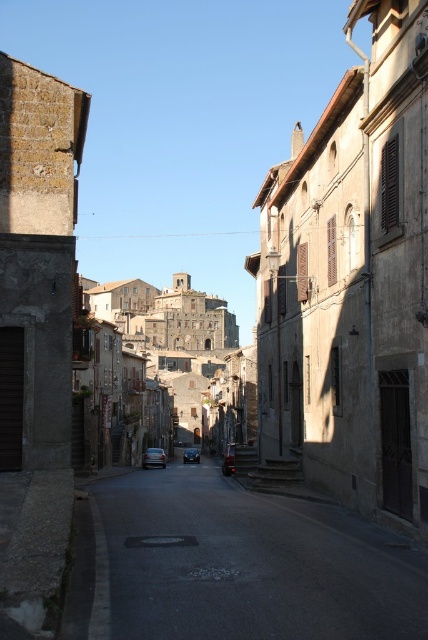
Question: Is stone castle at center smaller than shiny black sedan at center?

Choices:
 (A) yes
 (B) no

Answer: (B)

Question: Can you confirm if dark asphalt road at center is positioned above stone castle at center?

Choices:
 (A) no
 (B) yes

Answer: (A)

Question: Considering the real-world distances, which object is closest to the shiny black sedan at center?

Choices:
 (A) shiny silver car at center
 (B) dark gray metallic car at center
 (C) stone castle at center

Answer: (A)

Question: Which object is positioned farthest from the dark gray metallic car at center?

Choices:
 (A) stone castle at center
 (B) shiny silver car at center
 (C) dark asphalt road at center
 (D) shiny black sedan at center

Answer: (A)

Question: Which object is farther from the camera taking this photo?

Choices:
 (A) shiny black sedan at center
 (B) stone castle at center

Answer: (A)

Question: Can you confirm if stone castle at center is positioned below dark gray metallic car at center?

Choices:
 (A) yes
 (B) no

Answer: (B)